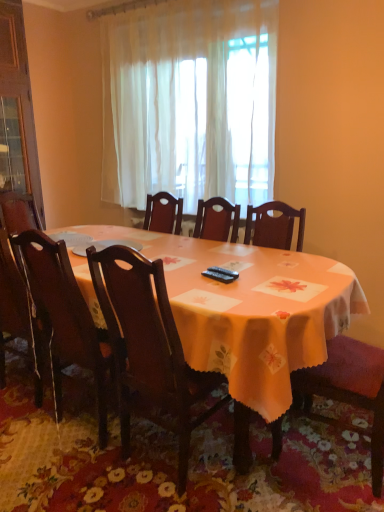
Question: Is wooden chair at right, which is counted as the third chair, starting from the left, wider than orange fabric table at center?

Choices:
 (A) no
 (B) yes

Answer: (A)

Question: Is wooden chair at right, the first chair when ordered from right to left, thinner than orange fabric table at center?

Choices:
 (A) yes
 (B) no

Answer: (A)

Question: Is orange fabric table at center inside wooden chair at right, the first chair when ordered from right to left?

Choices:
 (A) no
 (B) yes

Answer: (A)

Question: Can you confirm if wooden chair at right, which is counted as the third chair, starting from the left, is smaller than orange fabric table at center?

Choices:
 (A) yes
 (B) no

Answer: (A)

Question: From the image's perspective, is wooden chair at right, which is counted as the third chair, starting from the left, above orange fabric table at center?

Choices:
 (A) yes
 (B) no

Answer: (B)

Question: Considering the positions of point (274, 309) and point (147, 153), is point (274, 309) closer or farther from the camera than point (147, 153)?

Choices:
 (A) farther
 (B) closer

Answer: (B)

Question: Based on their sizes in the image, would you say orange fabric table at center is bigger or smaller than white sheer curtain at center?

Choices:
 (A) big
 (B) small

Answer: (A)

Question: Choose the correct answer: Is orange fabric table at center inside white sheer curtain at center or outside it?

Choices:
 (A) outside
 (B) inside

Answer: (A)

Question: Considering the positions of orange fabric table at center and white sheer curtain at center in the image, is orange fabric table at center taller or shorter than white sheer curtain at center?

Choices:
 (A) short
 (B) tall

Answer: (A)

Question: From a real-world perspective, is orange fabric table at center above or below dark wood chair at left, the 3th chair positioned from the right?

Choices:
 (A) above
 (B) below

Answer: (B)

Question: Relative to dark wood chair at left, the 3th chair positioned from the right, is orange fabric table at center in front or behind?

Choices:
 (A) front
 (B) behind

Answer: (A)

Question: Looking at the image, does orange fabric table at center seem bigger or smaller compared to dark wood chair at left, which ranks as the first chair in left-to-right order?

Choices:
 (A) small
 (B) big

Answer: (B)

Question: Is orange fabric table at center spatially inside dark wood chair at left, the 3th chair positioned from the right, or outside of it?

Choices:
 (A) outside
 (B) inside

Answer: (A)

Question: In terms of size, does floral fabric tablecloth at center appear bigger or smaller than dark wood chair at center, the second chair when ordered from right to left?

Choices:
 (A) small
 (B) big

Answer: (A)

Question: Is floral fabric tablecloth at center inside the boundaries of dark wood chair at center, placed as the 2th chair when sorted from left to right, or outside?

Choices:
 (A) outside
 (B) inside

Answer: (A)